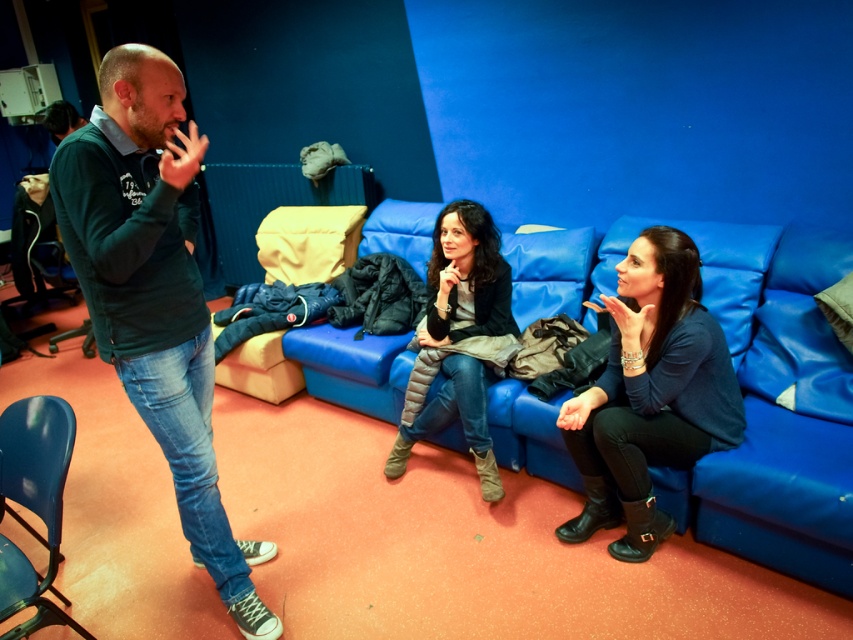
Question: Which of the following is the closest to the observer?

Choices:
 (A) (193, 300)
 (B) (680, 369)

Answer: (A)

Question: In this image, where is dark green sweater at left located relative to matte black sweater at center?

Choices:
 (A) left
 (B) right

Answer: (A)

Question: Does dark green sweater at left appear under matte black sweater at center?

Choices:
 (A) no
 (B) yes

Answer: (A)

Question: Among these objects, which one is nearest to the camera?

Choices:
 (A) matte black sweater at center
 (B) dark green sweater at left

Answer: (B)

Question: Can you confirm if matte black sweater at center is positioned below dark gray quilted jacket at center?

Choices:
 (A) yes
 (B) no

Answer: (A)

Question: Among these points, which one is farthest from the camera?

Choices:
 (A) (648, 515)
 (B) (457, 392)

Answer: (B)